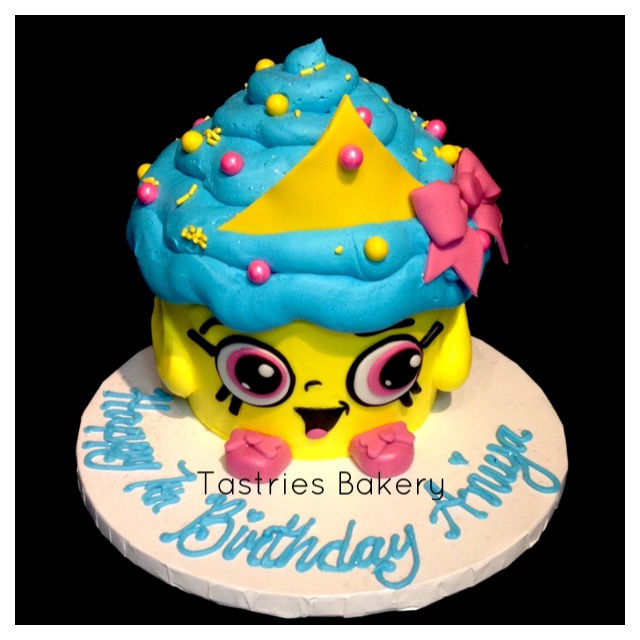
The height and width of the screenshot is (640, 640). I want to click on cake plate, so click(x=507, y=384).